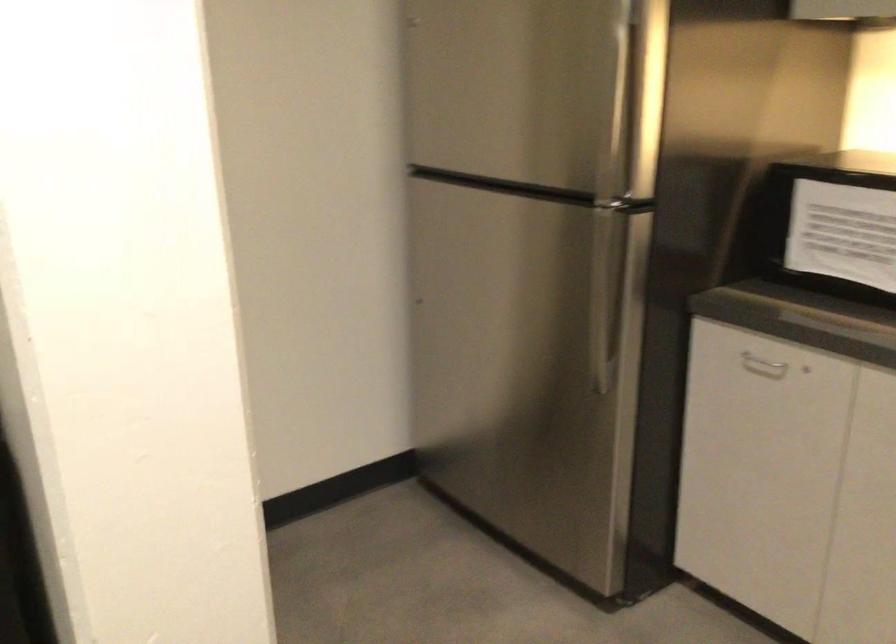
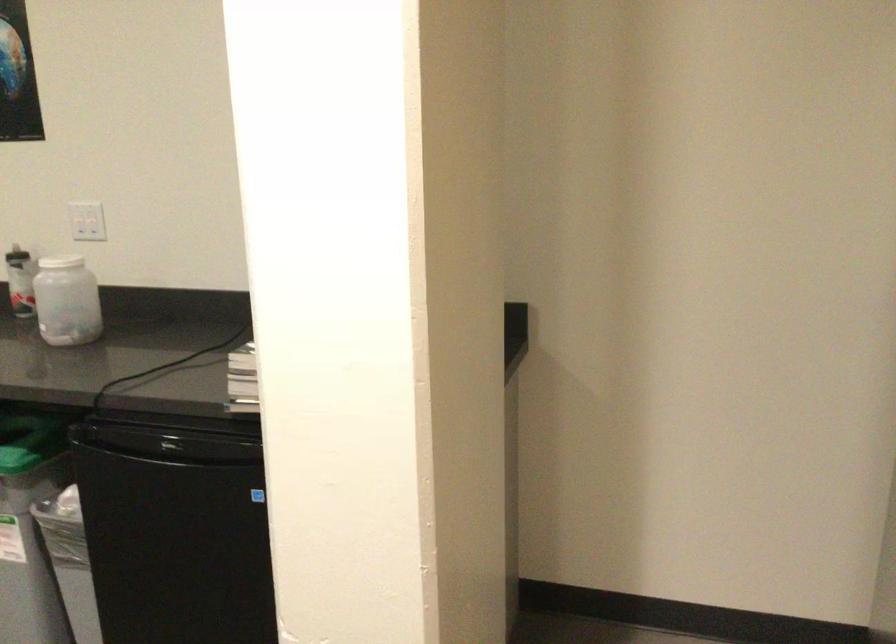
Question: The camera is either moving clockwise (left) or counter-clockwise (right) around the object. The first image is from the beginning of the video and the second image is from the end. Is the camera moving left or right when shooting the video?

Choices:
 (A) Left
 (B) Right

Answer: (B)